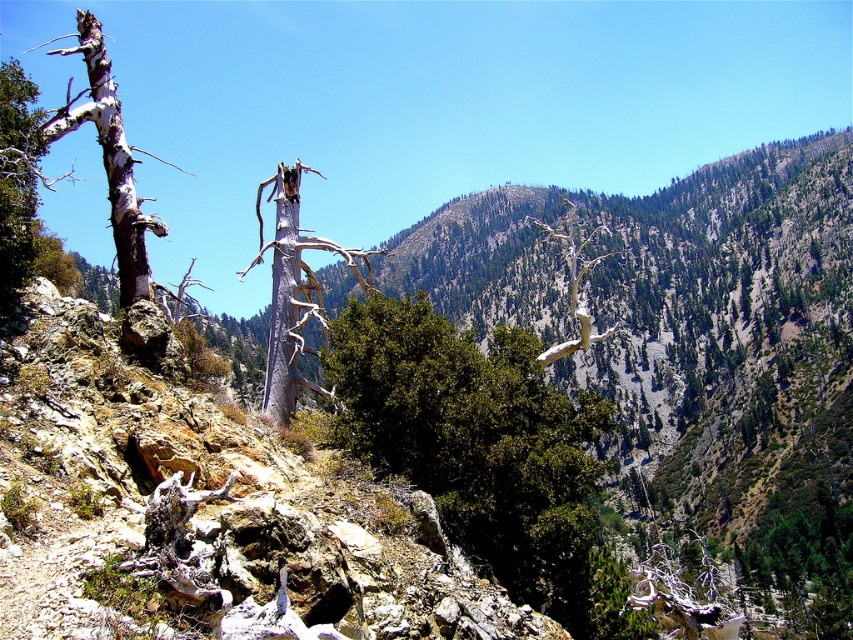
You are a hiker who wants to take a photo of both the gray bark tree at center and the gray bark tree at left. Which tree should you stand closer to in order to capture both in the same frame?

You should stand closer to the gray bark tree at center because it is smaller than the gray bark tree at left. By positioning yourself nearer to the smaller tree, you can include both trees within the camera frame more effectively.

You are a hiker navigating the rugged mountain terrain and spot a green leafy bush at center. Based on its position, can you determine if the bush is closer to you or further away compared to the dense cluster of green coniferous trees in the middle ground?

The green leafy bush at center is located at point (x=474, y=436), which places it closer to the foreground than the middle ground where the dense cluster of green coniferous trees are situated. Therefore, the bush is closer to you compared to the coniferous trees.